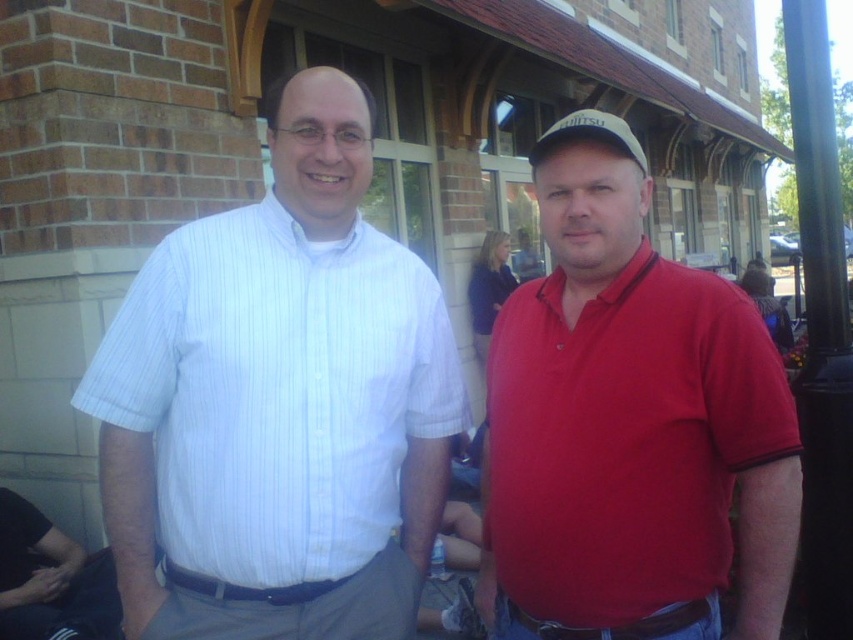
You are a photographer trying to capture both the white striped shirt at left and the matte red polo shirt at center in a single frame. Given that your camera can only accommodate the width of the wider object, which shirt should you adjust your focus to ensure both are fully visible?

The white striped shirt at left is wider than the matte red polo shirt at center. To ensure both are fully visible, adjust your focus to include the wider white striped shirt at left, as it requires more space.

You are a photographer trying to capture both the white striped shirt at left and the matte red polo shirt at center in a single frame. Based on their sizes in the image, which one would appear closer to the camera?

The white striped shirt at left appears closer to the camera because it is smaller than the matte red polo shirt at center, indicating it is farther away and thus smaller in the frame.